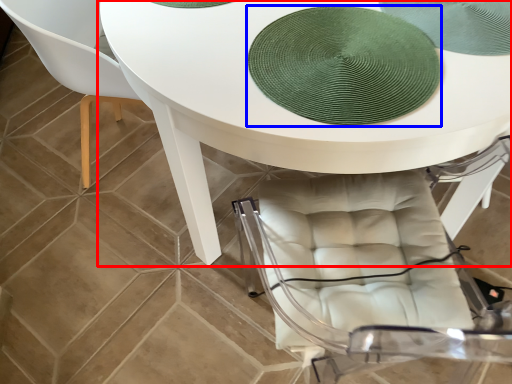
Question: Which object appears farthest to the camera in this image, table (highlighted by a red box) or mat (highlighted by a blue box)?

Choices:
 (A) table
 (B) mat

Answer: (B)